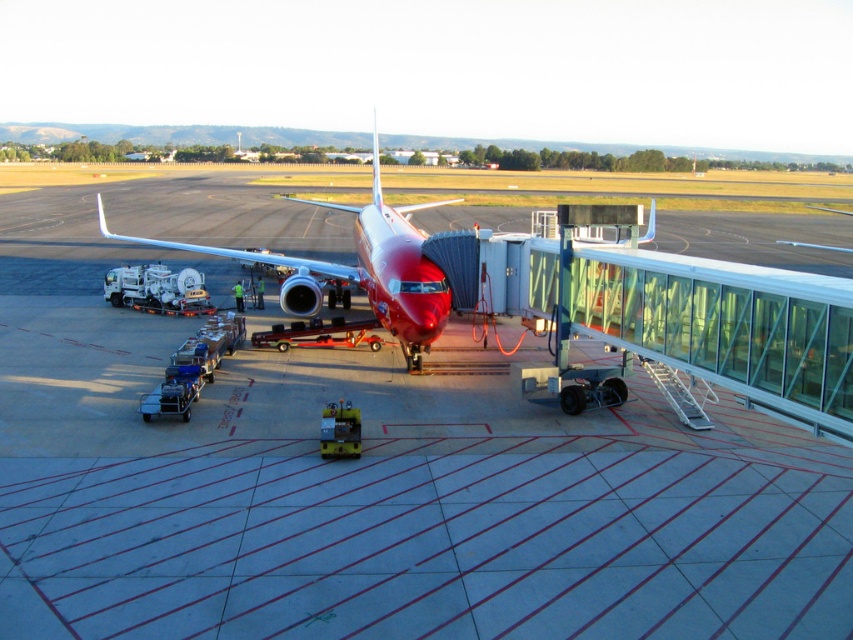
Question: Which of the following is the farthest from the observer?

Choices:
 (A) (x=100, y=582)
 (B) (x=325, y=272)

Answer: (B)

Question: Does smooth concrete tarmac at center appear under glossy red airplane at center?

Choices:
 (A) yes
 (B) no

Answer: (A)

Question: Among these objects, which one is nearest to the camera?

Choices:
 (A) glossy red airplane at center
 (B) smooth concrete tarmac at center

Answer: (B)

Question: Which point is farther to the camera?

Choices:
 (A) (430, 342)
 (B) (646, 467)

Answer: (A)

Question: Does smooth concrete tarmac at center have a smaller size compared to glossy red airplane at center?

Choices:
 (A) yes
 (B) no

Answer: (A)

Question: Is smooth concrete tarmac at center bigger than glossy red airplane at center?

Choices:
 (A) yes
 (B) no

Answer: (B)